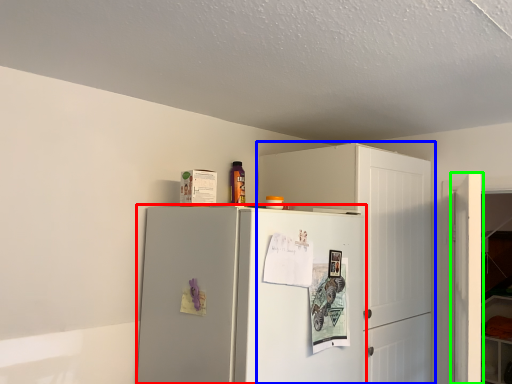
Question: Which object is positioned closest to refrigerator (highlighted by a red box)? Select from cabinetry (highlighted by a blue box) and door (highlighted by a green box).

Choices:
 (A) cabinetry
 (B) door

Answer: (A)